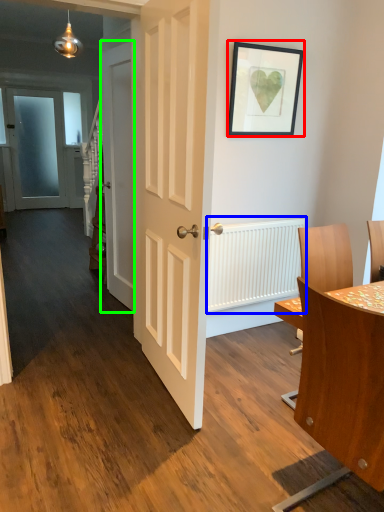
Question: Based on their relative distances, which object is farther from picture frame (highlighted by a red box)? Choose from radiator (highlighted by a blue box) and door (highlighted by a green box).

Choices:
 (A) radiator
 (B) door

Answer: (B)